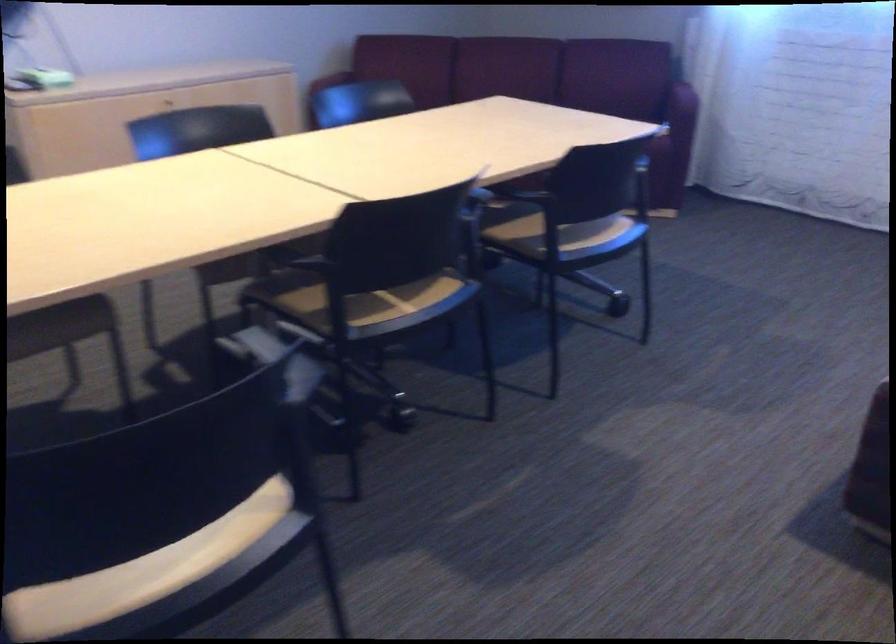
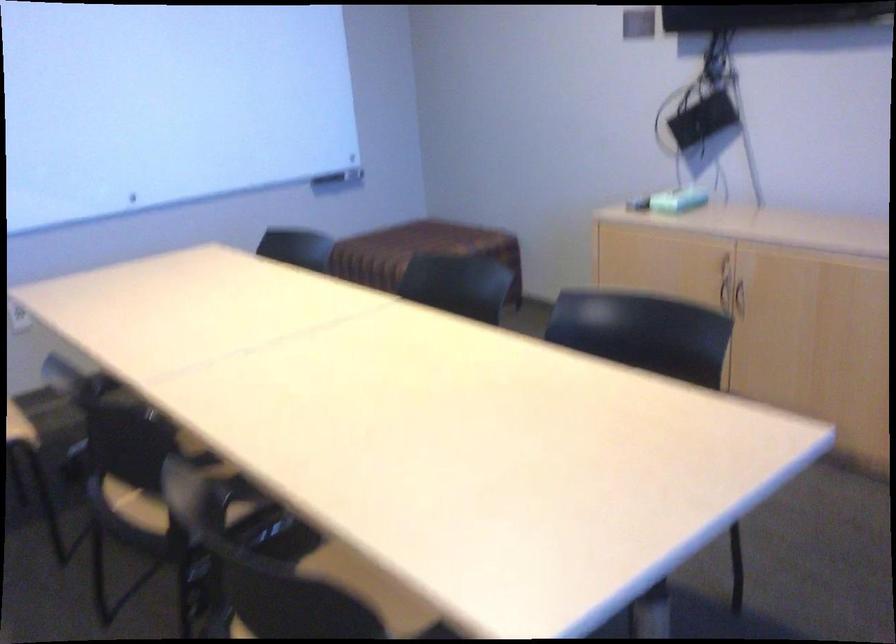
Locate, in the second image, the point that corresponds to point (504, 238) in the first image.

(337, 569)